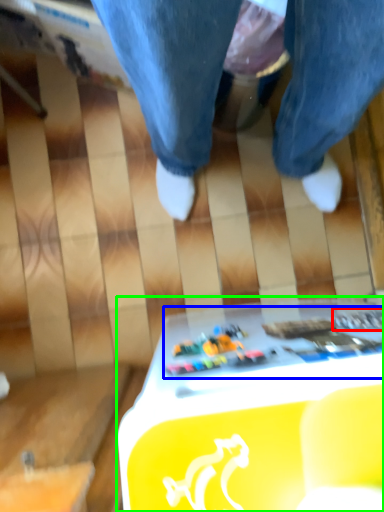
Question: Estimate the real-world distances between objects in this image. Which object is closer to writing (highlighted by a red box), writing (highlighted by a blue box) or table (highlighted by a green box)?

Choices:
 (A) writing
 (B) table

Answer: (A)